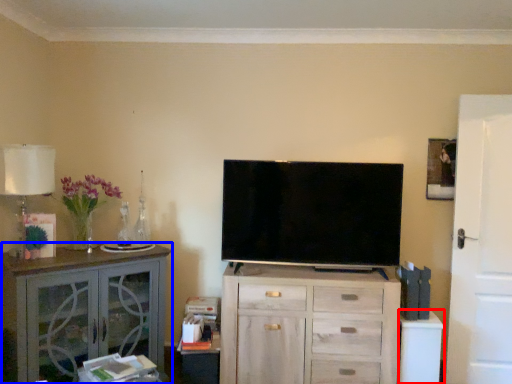
Question: Which object appears closest to the camera in this image, table (highlighted by a red box) or cabinetry (highlighted by a blue box)?

Choices:
 (A) table
 (B) cabinetry

Answer: (B)